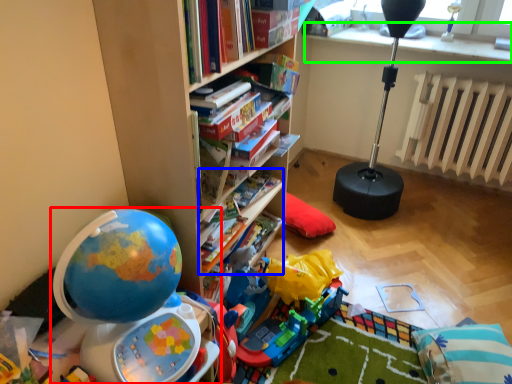
Question: Considering the real-world distances, which object is closest to toy (highlighted by a red box)? book (highlighted by a blue box) or window sill (highlighted by a green box).

Choices:
 (A) book
 (B) window sill

Answer: (A)